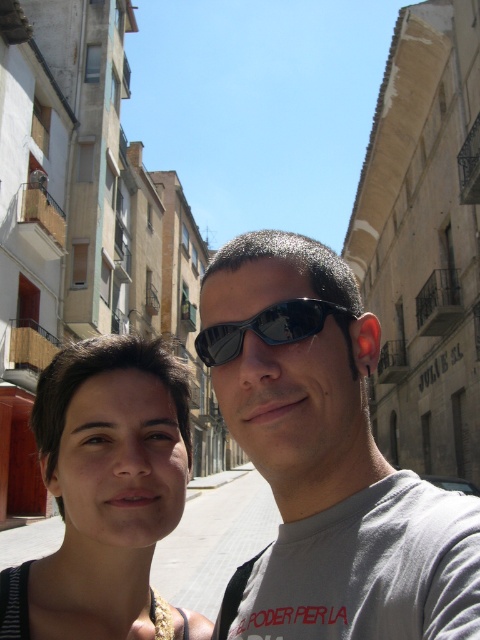
In the scene shown: You are a photographer trying to focus on the person on the right wearing the gray T shirt with red text. You notice a point at coordinates (327,458). Where is this point located?

The point at coordinates (327,458) is located on the matte gray t shirt at center.

You are a photographer trying to capture a clear shot of the matte black hair at center and the black reflective sunglasses at center. Which object should you focus on first to ensure both are in focus?

The matte black hair at center is positioned under black reflective sunglasses at center, so you should focus on the matte black hair at center first to ensure both are in focus.